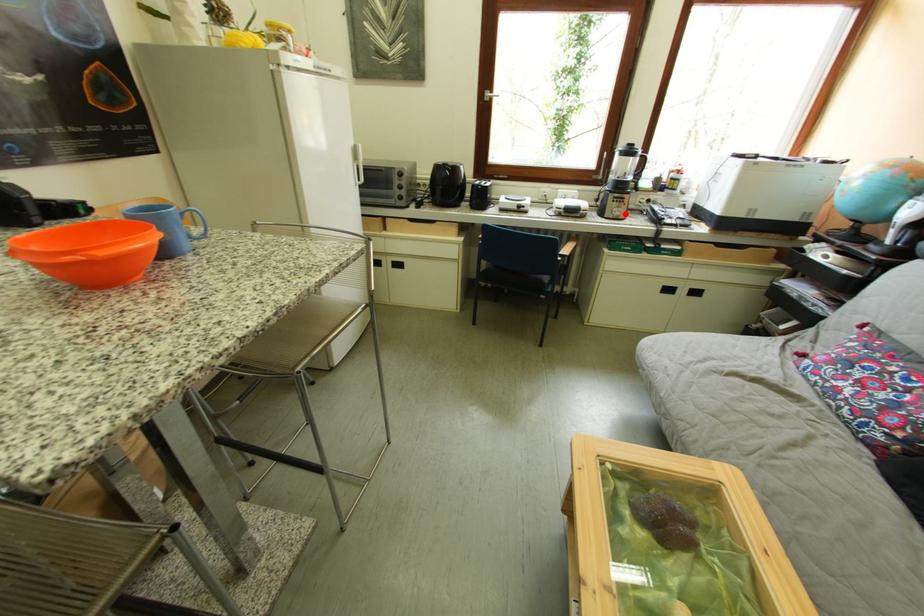
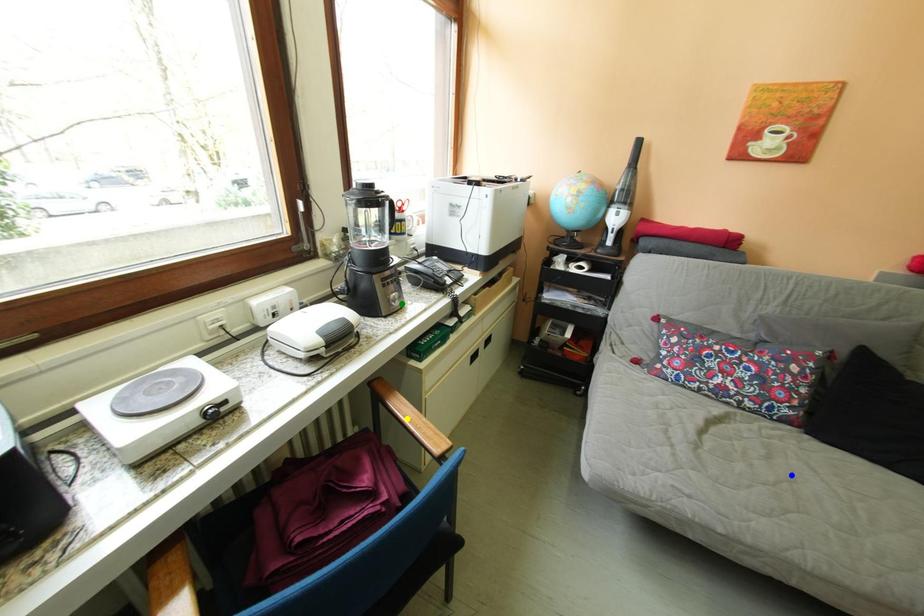
Question: I am providing you with two images of the same scene from different viewpoints. A red point is marked on the first image. You are given multiple points on the second image. Which mark in image 2 goes with the point in image 1?

Choices:
 (A) yellow point
 (B) blue point
 (C) green point

Answer: (C)